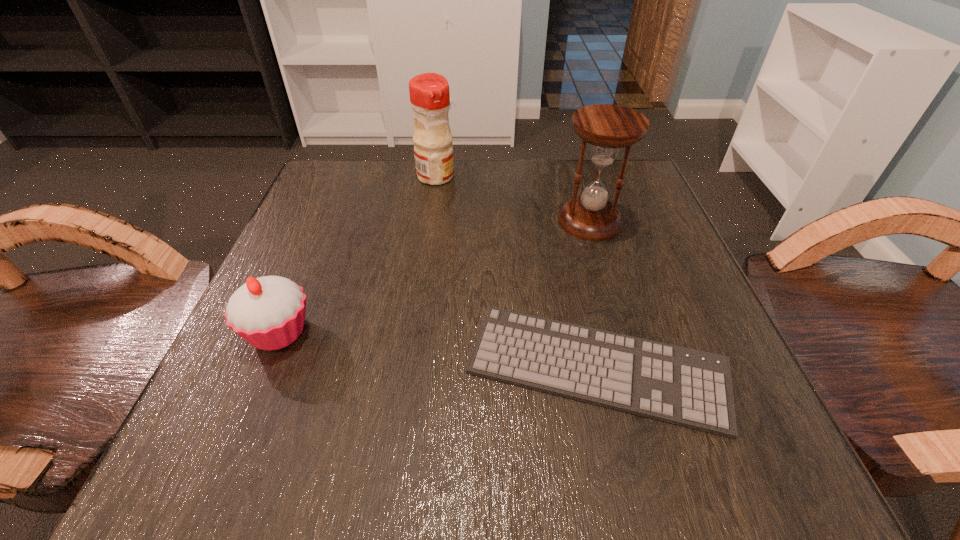
This screenshot has width=960, height=540. In the image, there is a desktop. In order to click on vacant space at the left edge in this screenshot , I will do `click(342, 289)`.

Locate an element on the screen. This screenshot has height=540, width=960. free region at the far left corner is located at coordinates (369, 218).

In the image, there is a desktop. Where is `free space at the far right corner`? This screenshot has width=960, height=540. free space at the far right corner is located at coordinates [x=603, y=174].

Where is `free space between the second shortest object and the second object from left to right`? free space between the second shortest object and the second object from left to right is located at coordinates (357, 254).

Locate an element on the screen. empty location between the condiment and the cupcake is located at coordinates (357, 254).

The height and width of the screenshot is (540, 960). In order to click on free space that is in between the computer keyboard and the second shortest object in this screenshot , I will do (x=438, y=350).

I want to click on vacant region between the second object from left to right and the shortest object, so click(x=516, y=272).

Find the location of a particular element. blank region between the farthest object and the shortest object is located at coordinates (516, 272).

Find the location of a particular element. empty space between the farthest object and the shortest object is located at coordinates (516, 272).

Where is `free space between the second shortest object and the condiment`? This screenshot has height=540, width=960. free space between the second shortest object and the condiment is located at coordinates (357, 254).